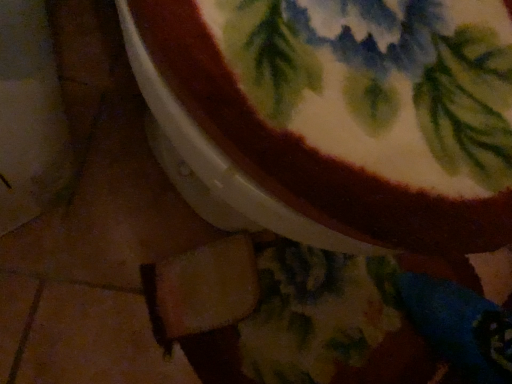
Image resolution: width=512 pixels, height=384 pixels. Find the location of `matte white watermelon at center`. matte white watermelon at center is located at coordinates (345, 114).

What do you see at coordinates (345, 114) in the screenshot?
I see `matte white watermelon at center` at bounding box center [345, 114].

Find the location of a particular element. This screenshot has width=512, height=384. matte white watermelon at center is located at coordinates (345, 114).